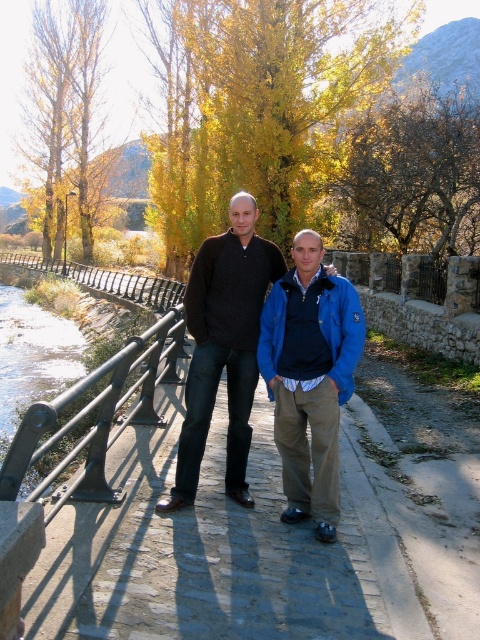
Question: Is blue fabric jacket at center further to the viewer compared to black metal railing at left?

Choices:
 (A) no
 (B) yes

Answer: (B)

Question: Which of the following is the closest to the observer?

Choices:
 (A) matte black sweater at center
 (B) blue fabric jacket at center

Answer: (B)

Question: Is matte black sweater at center in front of black metal railing at left?

Choices:
 (A) no
 (B) yes

Answer: (A)

Question: In this image, where is matte black sweater at center located relative to black metal railing at left?

Choices:
 (A) left
 (B) right

Answer: (B)

Question: Among these points, which one is nearest to the camera?

Choices:
 (A) (101, 480)
 (B) (352, 320)
 (C) (240, 320)

Answer: (B)

Question: Estimate the real-world distances between objects in this image. Which object is farther from the blue fabric jacket at center?

Choices:
 (A) matte black sweater at center
 (B) black metal railing at left

Answer: (B)